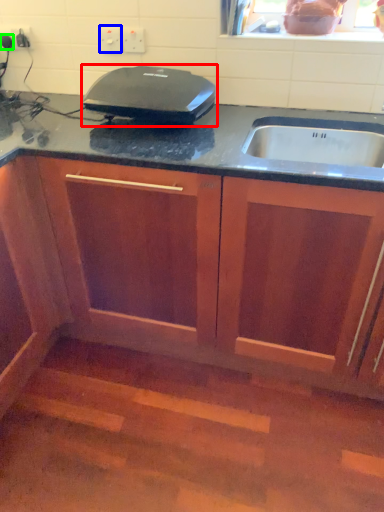
Question: Which is farther away from home appliance (highlighted by a red box)? electric outlet (highlighted by a blue box) or kitchen appliance (highlighted by a green box)?

Choices:
 (A) electric outlet
 (B) kitchen appliance

Answer: (B)